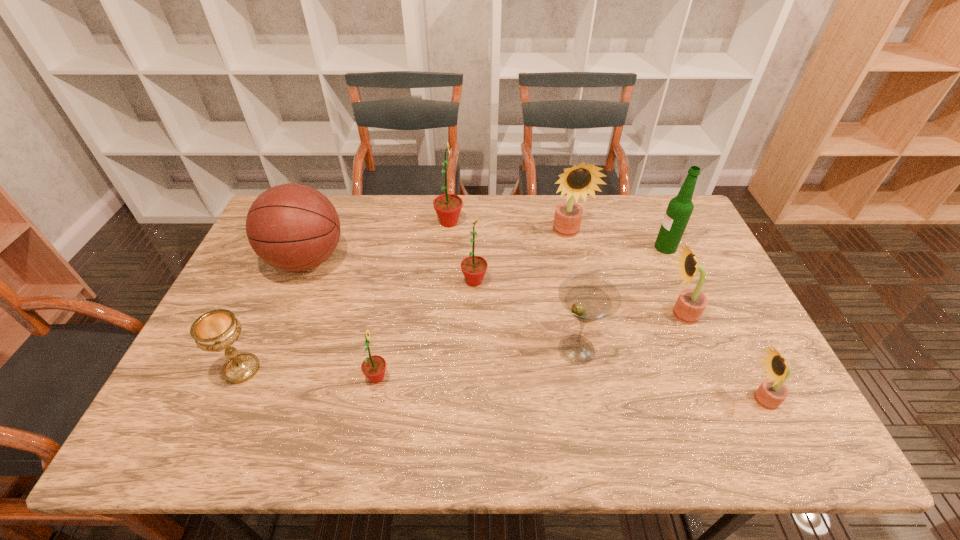
Locate an element on the screen. The height and width of the screenshot is (540, 960). the second closest object to the biggest yellow sunflower is located at coordinates (474, 268).

Where is `object that stands as the closest to the second sunflower from right to left`? This screenshot has height=540, width=960. object that stands as the closest to the second sunflower from right to left is located at coordinates (772, 392).

Where is `sunflower that stands as the third closest to the eighth object from right to left`? Image resolution: width=960 pixels, height=540 pixels. sunflower that stands as the third closest to the eighth object from right to left is located at coordinates (579, 180).

Locate which sunflower ranks sixth in proximity to the green beer bottle. Please provide its 2D coordinates. Your answer should be formatted as a tuple, i.e. [(x, y)], where the tuple contains the x and y coordinates of a point satisfying the conditions above.

[(373, 367)]

Locate an element on the screen. The image size is (960, 540). green sunflower that stands as the second closest to the sixth object from right to left is located at coordinates (373, 367).

Locate an element on the screen. This screenshot has width=960, height=540. the third closest green sunflower relative to the green beer bottle is located at coordinates (373, 367).

At what (x,y) coordinates should I click in order to perform the action: click on yellow sunflower that is the nearest to the biggest green sunflower. Please return your answer as a coordinate pair (x, y). Looking at the image, I should click on (579, 180).

Locate an element on the screen. This screenshot has width=960, height=540. yellow sunflower object that ranks as the third closest to the leftmost green sunflower is located at coordinates (772, 392).

This screenshot has height=540, width=960. I want to click on vacant space that satisfies the following two spatial constraints: 1. on the face of the fourth sunflower from left to right; 2. on the face of the fourth sunflower from right to left, so click(x=577, y=281).

I want to click on free space in the image that satisfies the following two spatial constraints: 1. on the face of the seventh object from right to left; 2. on the back side of the martini, so click(x=439, y=349).